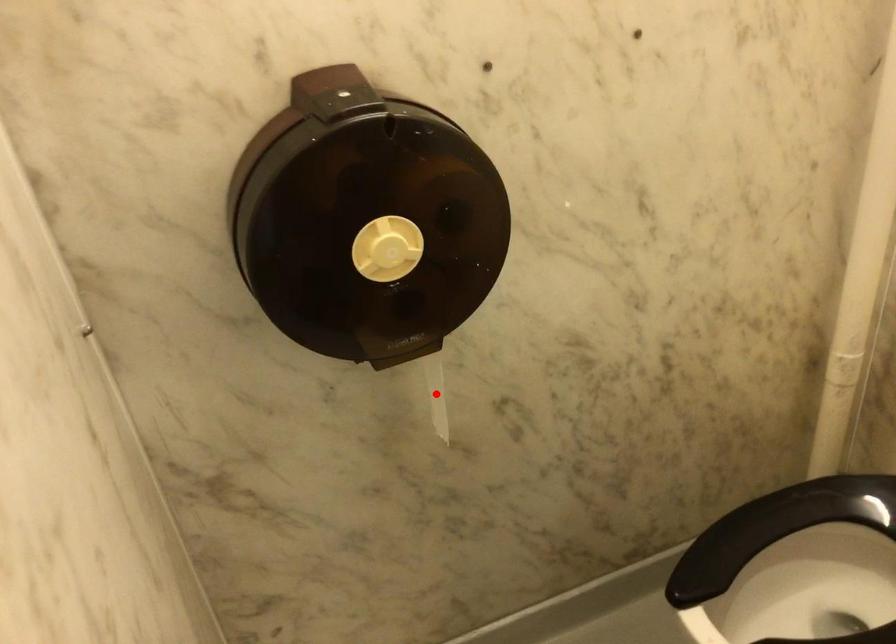
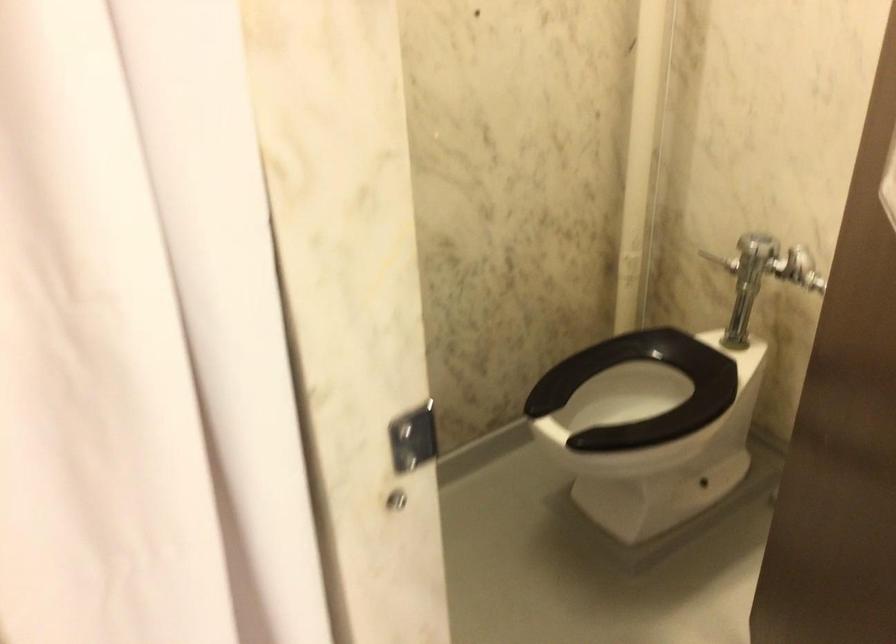
Question: I am providing you with two images of the same scene from different viewpoints. A red point is marked on the first image. At the location where the point appears in image 1, is it still visible in image 2?

Choices:
 (A) Yes
 (B) No

Answer: (B)